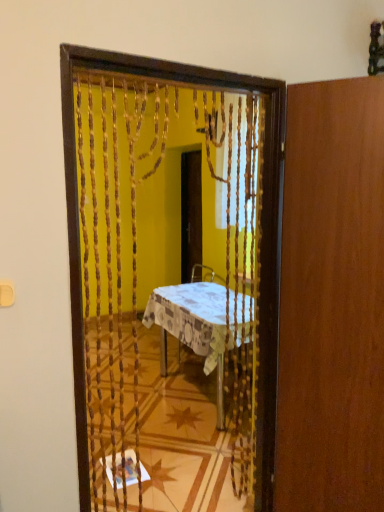
Question: In terms of width, does wooden screen door at center look wider or thinner when compared to patterned fabric table at center?

Choices:
 (A) wide
 (B) thin

Answer: (B)

Question: In the image, is wooden screen door at center positioned in front of or behind patterned fabric table at center?

Choices:
 (A) front
 (B) behind

Answer: (B)

Question: Based on their relative distances, which object is farther from the wooden beaded curtain at center?

Choices:
 (A) wooden door at right
 (B) wooden screen door at center
 (C) patterned fabric table at center

Answer: (B)

Question: Which of these objects is positioned farthest from the wooden screen door at center?

Choices:
 (A) wooden beaded curtain at center
 (B) wooden door at right
 (C) patterned fabric table at center

Answer: (B)